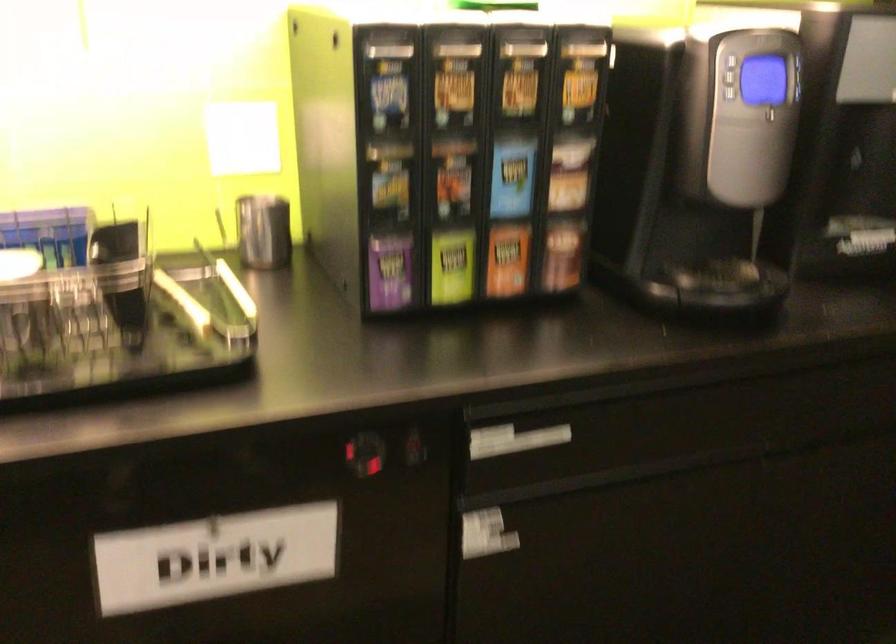
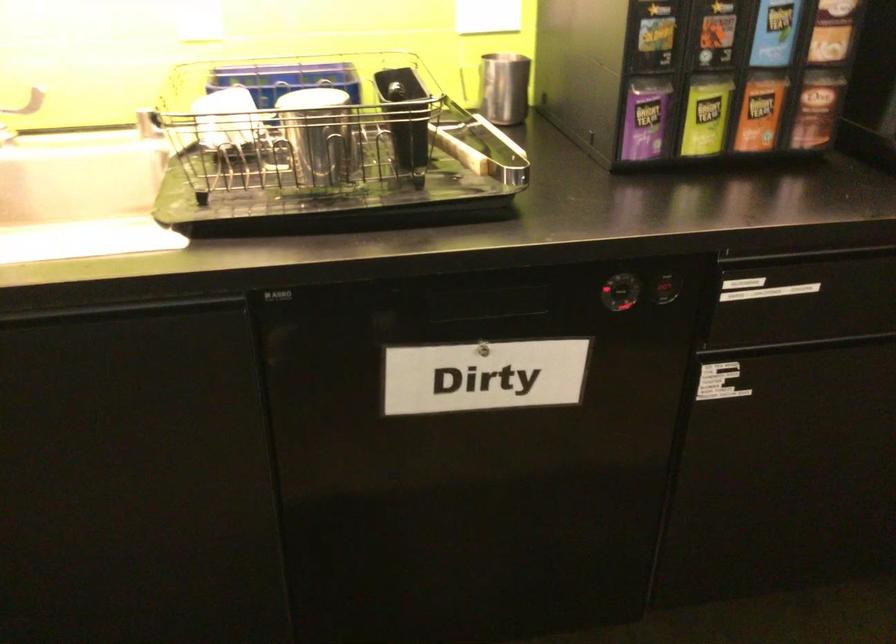
Question: The first image is from the beginning of the video and the second image is from the end. How did the camera likely rotate when shooting the video?

Choices:
 (A) Left
 (B) Right
 (C) Up
 (D) Down

Answer: (A)